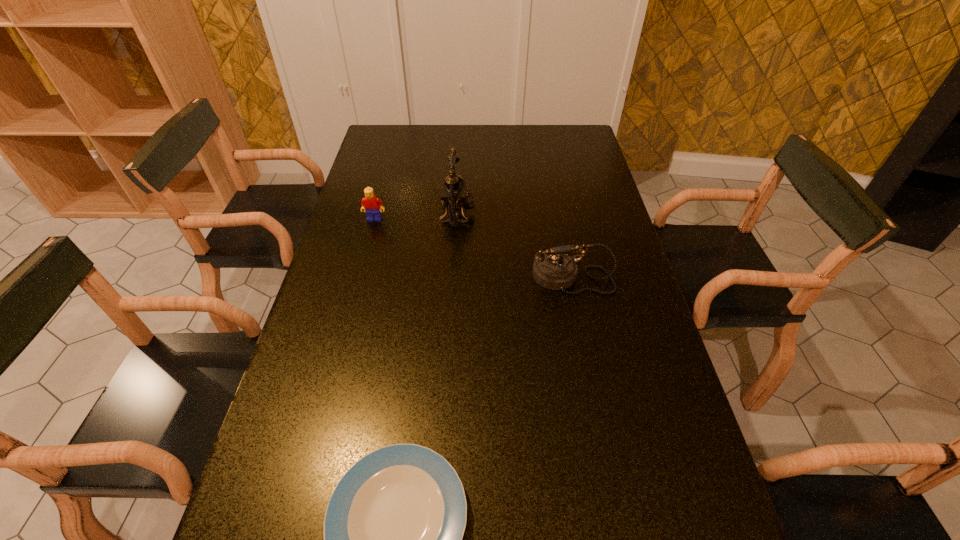
In the image, there is a desktop. At what (x,y) coordinates should I click in order to perform the action: click on vacant region at the far edge. Please return your answer as a coordinate pair (x, y). Looking at the image, I should click on (433, 151).

The height and width of the screenshot is (540, 960). In order to click on free spot at the left edge of the desktop in this screenshot , I will do `click(308, 385)`.

The height and width of the screenshot is (540, 960). I want to click on free region at the right edge of the desktop, so click(x=587, y=216).

Find the location of a particular element. The image size is (960, 540). vacant space at the far right corner is located at coordinates (549, 138).

Find the location of `empty location between the rightmost object and the taller telephone`. empty location between the rightmost object and the taller telephone is located at coordinates (515, 245).

Locate an element on the screen. free spot between the tallest object and the leftmost object is located at coordinates (416, 217).

In order to click on free spot between the Lego and the shorter telephone in this screenshot , I will do `click(473, 248)`.

Where is `free spot between the farther telephone and the nearer telephone`? free spot between the farther telephone and the nearer telephone is located at coordinates (515, 245).

Select which object is the closest to the farther telephone. Please provide its 2D coordinates. Your answer should be formatted as a tuple, i.e. [(x, y)], where the tuple contains the x and y coordinates of a point satisfying the conditions above.

[(370, 204)]

Select which object appears as the second closest to the nearest object. Please provide its 2D coordinates. Your answer should be formatted as a tuple, i.e. [(x, y)], where the tuple contains the x and y coordinates of a point satisfying the conditions above.

[(454, 195)]